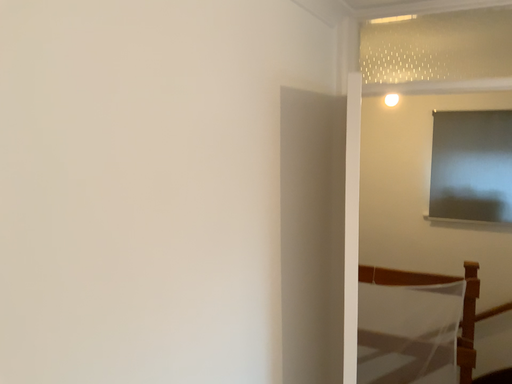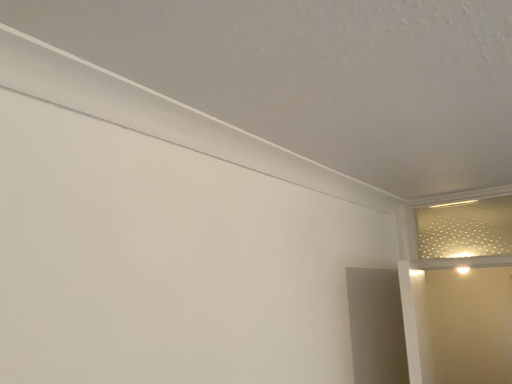
Question: How did the camera likely rotate when shooting the video?

Choices:
 (A) rotated downward
 (B) rotated upward

Answer: (B)